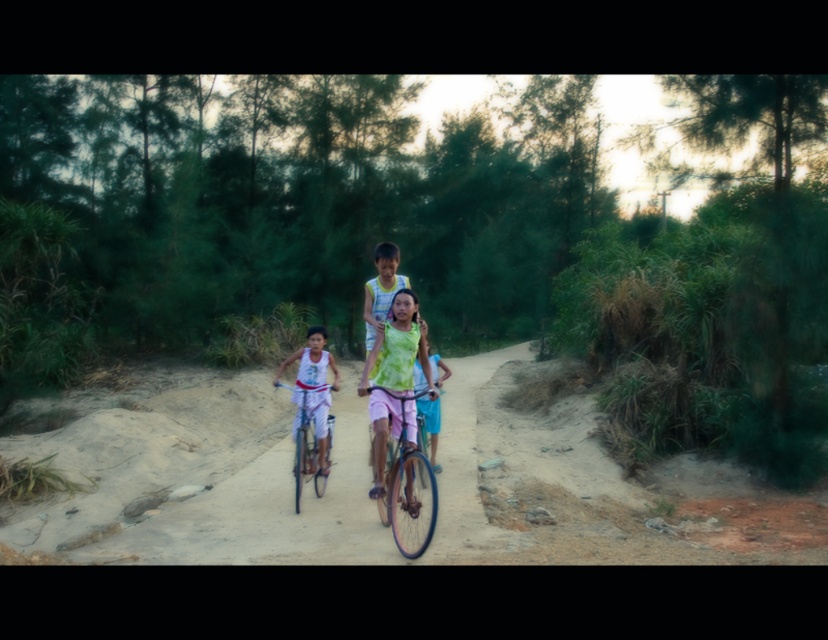
Which is behind, point (302, 532) or point (297, 384)?

Positioned behind is point (297, 384).

Is the position of brown sandy dirt track at center less distant than that of metallic silver bicycle at center?

That is True.

The image size is (828, 640). Describe the element at coordinates (201, 483) in the screenshot. I see `brown sandy dirt track at center` at that location.

Identify the location of brown sandy dirt track at center. (201, 483).

Measure the distance between point (x=410, y=496) and camera.

A distance of 24.13 feet exists between point (x=410, y=496) and camera.

Between metallic blue bicycle at center and metallic silver bicycle at center, which one has more height?

metallic blue bicycle at center is taller.

Between point (424, 472) and point (296, 448), which one is positioned behind?

Positioned behind is point (296, 448).

Where is `metallic blue bicycle at center`? The height and width of the screenshot is (640, 828). metallic blue bicycle at center is located at coordinates (408, 496).

Does point (372, 394) lie in front of point (311, 448)?

Yes, point (372, 394) is in front of point (311, 448).

Between light green tie-dye shirt at center and metallic silver bicycle at center, which one has more height?

With more height is light green tie-dye shirt at center.

Locate an element on the screen. light green tie-dye shirt at center is located at coordinates point(397,349).